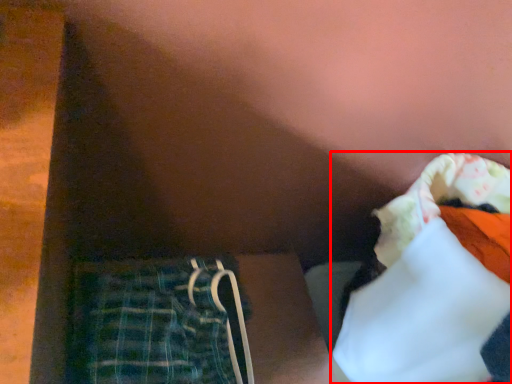
Question: Where is clothing (annotated by the red box) located in relation to trousers in the image?

Choices:
 (A) left
 (B) right

Answer: (B)